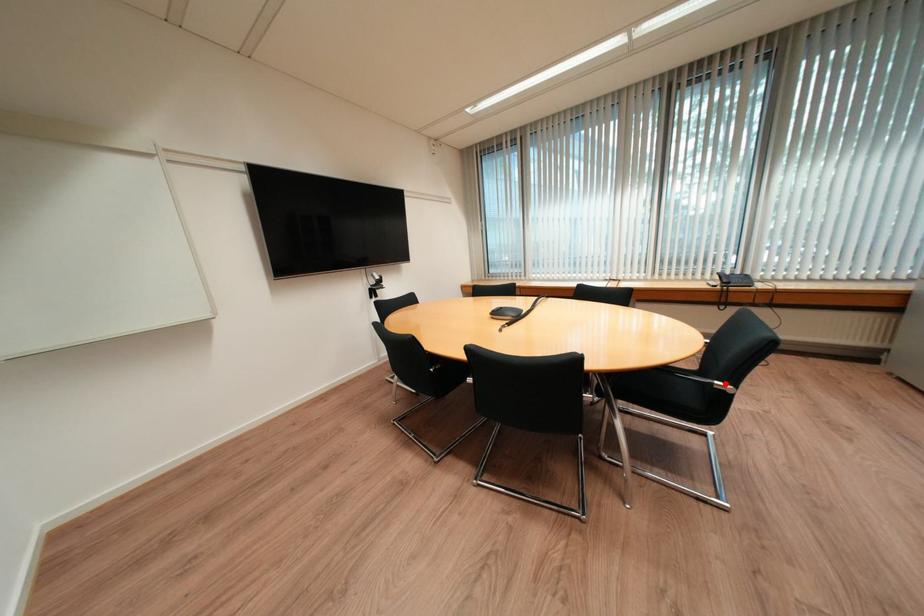
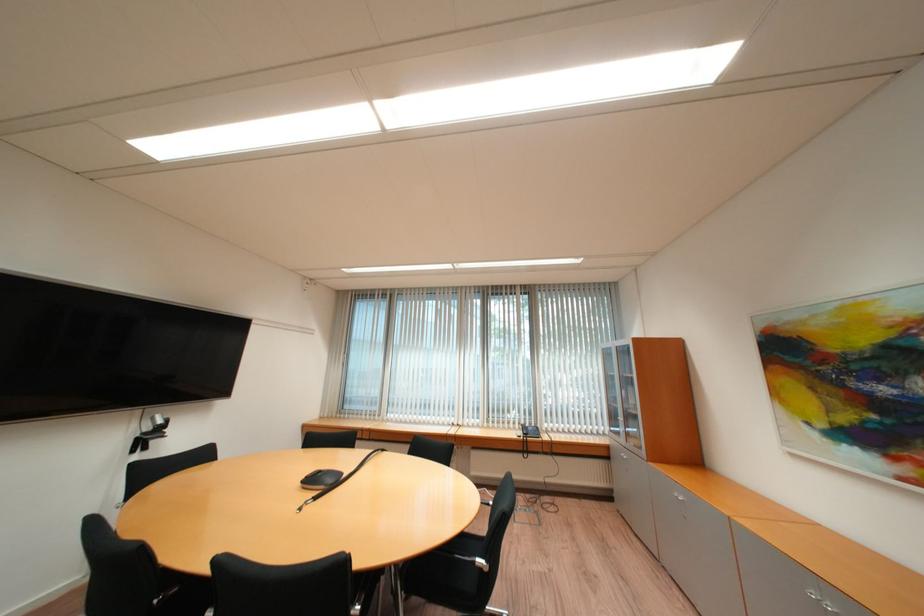
In the second image, find the point that corresponds to the highlighted location in the first image.

(487, 561)